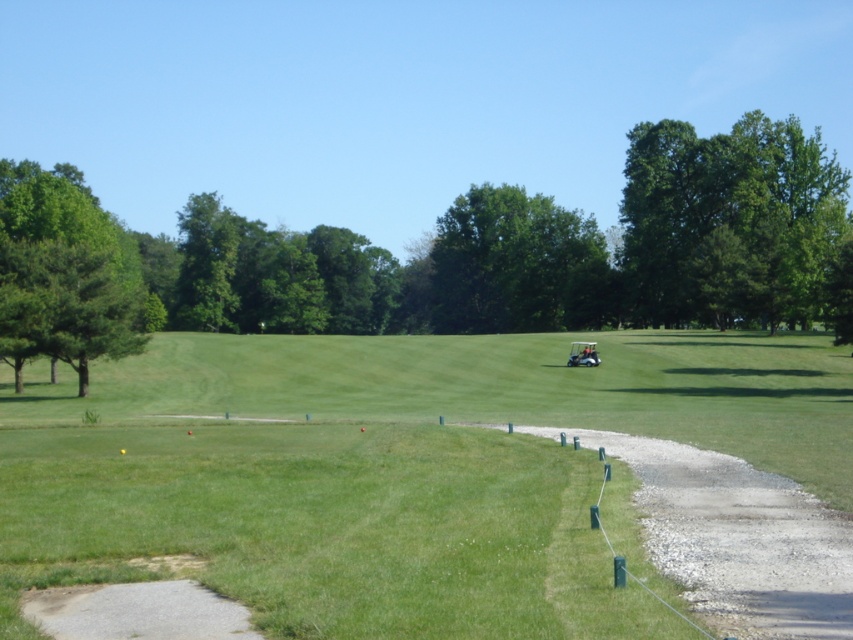
Looking at this image, you are standing at the golf cart parked on the grass and want to walk to the point marked at coordinate point (148, 337). There is another point at point (698, 307). Which point is closer to your current position?

Point (148, 337) is closer to your current position because you are standing at the golf cart, and the question specifies walking to that point, implying it is nearer. The other point is behind it according to the description.

You are a golfer standing at the tee and want to hit a ball towards the green. There are two trees in your path. Which tree, the green leafy tree at left or the green leafy tree at center, is closer to you?

The green leafy tree at left is closer to you because it is positioned under the green leafy tree at center, meaning it is in front of the other tree from your perspective.

You are a golfer standing on the green grassy golf course at center and want to hit a ball to the green leafy tree at left. Considering the spatial relationship between them, which direction should you aim to ensure the ball reaches the tree?

The green grassy golf course at center is wider than the green leafy tree at left, so you should aim towards the left side of the tree to ensure the ball reaches the green leafy tree at left.